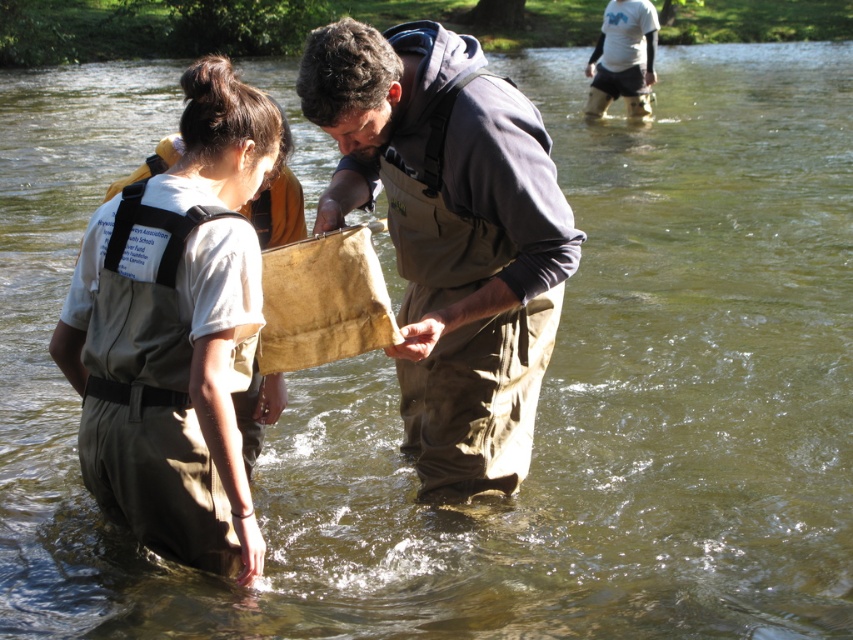
Question: Is the position of brown canvas bag at center less distant than that of khaki fabric waders at left?

Choices:
 (A) yes
 (B) no

Answer: (B)

Question: Which point is closer to the camera?

Choices:
 (A) white t-shirt at upper center
 (B) brown canvas bag at center
 (C) khaki fabric waders at left

Answer: (C)

Question: Which object is positioned closest to the brown canvas bag at center?

Choices:
 (A) white t-shirt at upper center
 (B) khaki fabric waders at left

Answer: (B)

Question: Is brown canvas bag at center positioned behind khaki fabric waders at left?

Choices:
 (A) no
 (B) yes

Answer: (B)

Question: Estimate the real-world distances between objects in this image. Which object is closer to the white t-shirt at upper center?

Choices:
 (A) khaki fabric waders at left
 (B) brown canvas bag at center

Answer: (B)

Question: Can you confirm if brown canvas bag at center is positioned to the right of white t-shirt at upper center?

Choices:
 (A) yes
 (B) no

Answer: (B)